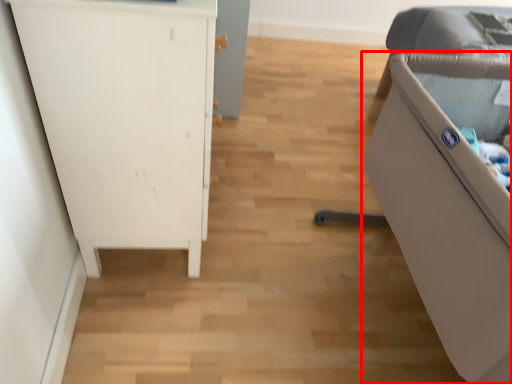
Question: Observing the image, what is the correct spatial positioning of furniture (annotated by the red box) in reference to furniture?

Choices:
 (A) right
 (B) left

Answer: (A)